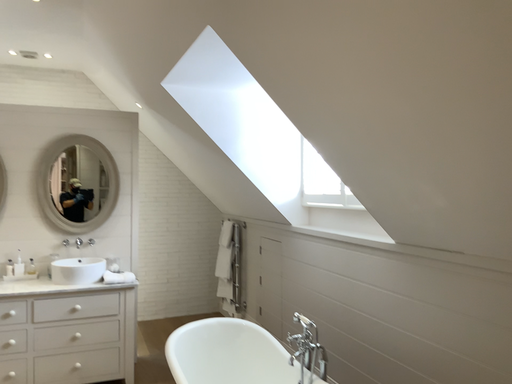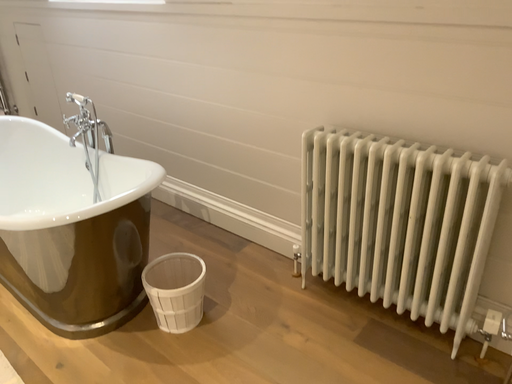
Question: How did the camera likely rotate when shooting the video?

Choices:
 (A) rotated right
 (B) rotated left

Answer: (A)